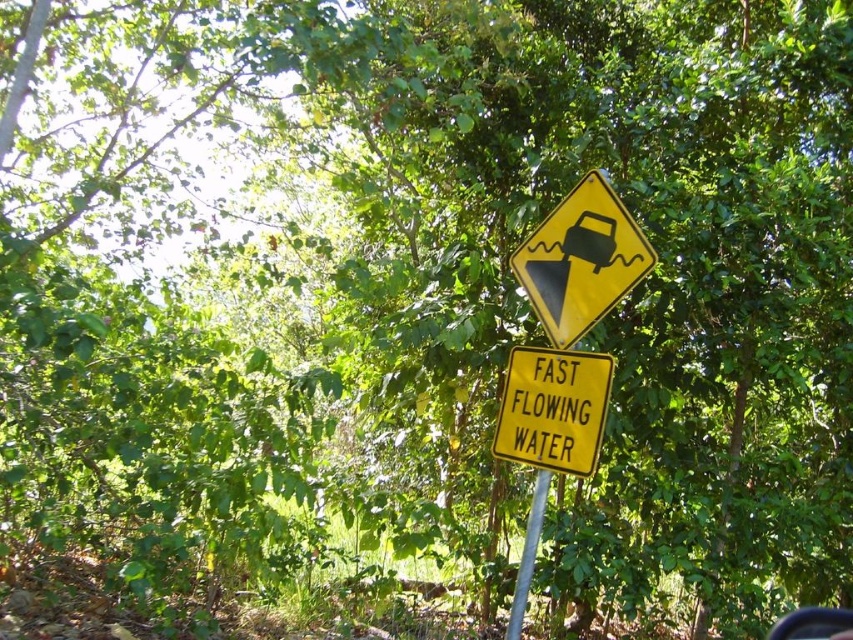
Question: Which object is positioned farthest from the yellow plastic sign at center?

Choices:
 (A) transparent glass car window at center
 (B) metallic silver pole at center

Answer: (A)

Question: Which of the following is the closest to the observer?

Choices:
 (A) yellow/yellowish metal sign at center
 (B) metallic silver pole at center

Answer: (A)

Question: Can you confirm if yellow plastic sign at center is positioned to the left of yellow/yellowish metal sign at center?

Choices:
 (A) yes
 (B) no

Answer: (B)

Question: Can you confirm if metallic silver pole at center is positioned to the right of transparent glass car window at center?

Choices:
 (A) yes
 (B) no

Answer: (B)

Question: Which object appears closest to the camera in this image?

Choices:
 (A) transparent glass car window at center
 (B) yellow plastic sign at center

Answer: (B)

Question: Does yellow/yellowish metal sign at center come in front of metallic silver pole at center?

Choices:
 (A) no
 (B) yes

Answer: (B)